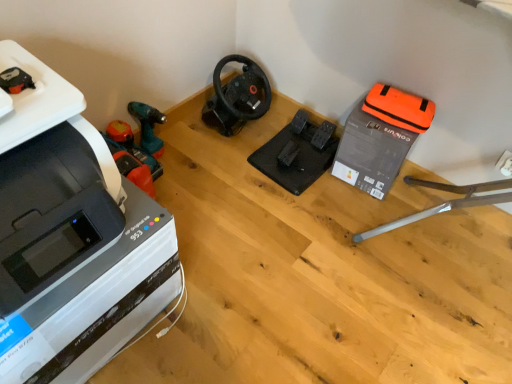
Question: Is orange plastic vacuum at left, which ranks as the 2th vacuum in right-to-left order, completely or partially inside black rubber pedals at center, which is the 1th equipment in left-to-right order?

Choices:
 (A) yes
 (B) no

Answer: (B)

Question: Considering the relative sizes of black rubber pedals at center, which is the second equipment in right-to-left order, and orange plastic vacuum at left, the first vacuum from the left, in the image provided, is black rubber pedals at center, which is the second equipment in right-to-left order, smaller than orange plastic vacuum at left, the first vacuum from the left,?

Choices:
 (A) no
 (B) yes

Answer: (A)

Question: Considering the relative sizes of black rubber pedals at center, which is the second equipment in right-to-left order, and orange plastic vacuum at left, the first vacuum from the left, in the image provided, is black rubber pedals at center, which is the second equipment in right-to-left order, wider than orange plastic vacuum at left, the first vacuum from the left,?

Choices:
 (A) no
 (B) yes

Answer: (B)

Question: From the image's perspective, does black rubber pedals at center, which is the second equipment in right-to-left order, appear higher than orange plastic vacuum at left, which ranks as the 2th vacuum in right-to-left order?

Choices:
 (A) yes
 (B) no

Answer: (A)

Question: Does black rubber pedals at center, which is the 1th equipment in left-to-right order, touch orange plastic vacuum at left, which ranks as the 2th vacuum in right-to-left order?

Choices:
 (A) no
 (B) yes

Answer: (A)

Question: Is black rubber pedals at center, which is the 1th equipment in left-to-right order, at the left side of orange plastic vacuum at left, the first vacuum from the left?

Choices:
 (A) yes
 (B) no

Answer: (B)

Question: Does orange plastic vacuum at left, which ranks as the 2th vacuum in right-to-left order, have a smaller size compared to black matte steering wheel at center, the second vacuum positioned from the left?

Choices:
 (A) yes
 (B) no

Answer: (A)

Question: Can you confirm if orange plastic vacuum at left, which ranks as the 2th vacuum in right-to-left order, is wider than black matte steering wheel at center, the second vacuum positioned from the left?

Choices:
 (A) no
 (B) yes

Answer: (A)

Question: From a real-world perspective, is orange plastic vacuum at left, the first vacuum from the left, positioned under black matte steering wheel at center, positioned as the first vacuum in right-to-left order, based on gravity?

Choices:
 (A) yes
 (B) no

Answer: (A)

Question: Is orange plastic vacuum at left, which ranks as the 2th vacuum in right-to-left order, outside black matte steering wheel at center, positioned as the first vacuum in right-to-left order?

Choices:
 (A) no
 (B) yes

Answer: (B)

Question: From the image's perspective, does orange plastic vacuum at left, the first vacuum from the left, appear higher than black matte steering wheel at center, positioned as the first vacuum in right-to-left order?

Choices:
 (A) yes
 (B) no

Answer: (B)

Question: Is orange plastic vacuum at left, the first vacuum from the left, oriented towards black matte steering wheel at center, positioned as the first vacuum in right-to-left order?

Choices:
 (A) no
 (B) yes

Answer: (A)

Question: Considering the relative positions of orange fabric bag at upper right, which appears as the second equipment when viewed from the left, and black matte steering wheel at center, positioned as the first vacuum in right-to-left order, in the image provided, is orange fabric bag at upper right, which appears as the second equipment when viewed from the left, to the right of black matte steering wheel at center, positioned as the first vacuum in right-to-left order, from the viewer's perspective?

Choices:
 (A) no
 (B) yes

Answer: (B)